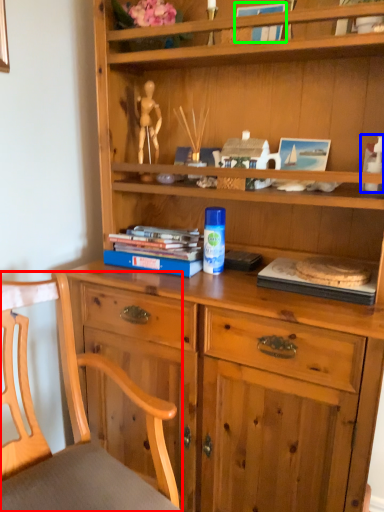
Question: Considering the real-world distances, which object is closest to chair (highlighted by a red box)? toy (highlighted by a blue box) or book (highlighted by a green box).

Choices:
 (A) toy
 (B) book

Answer: (A)